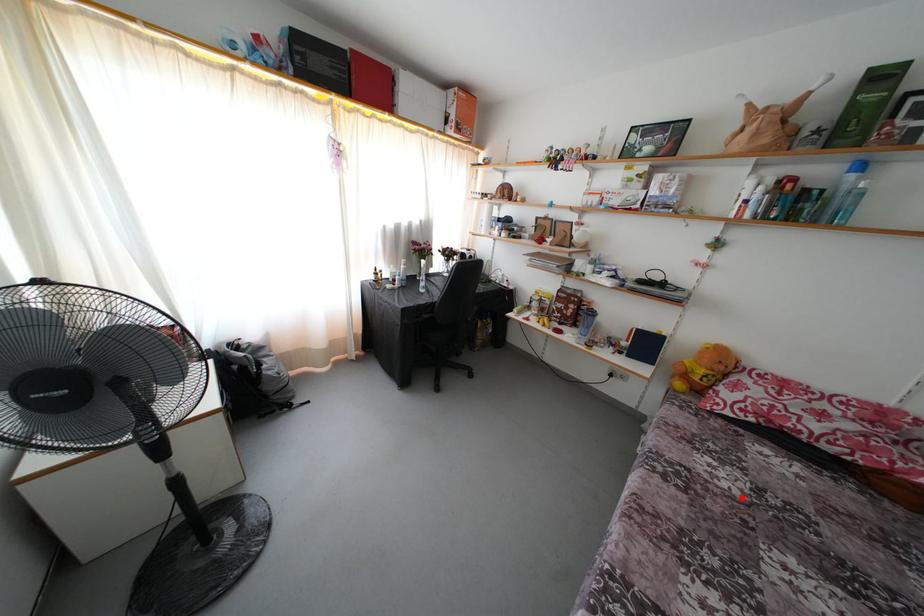
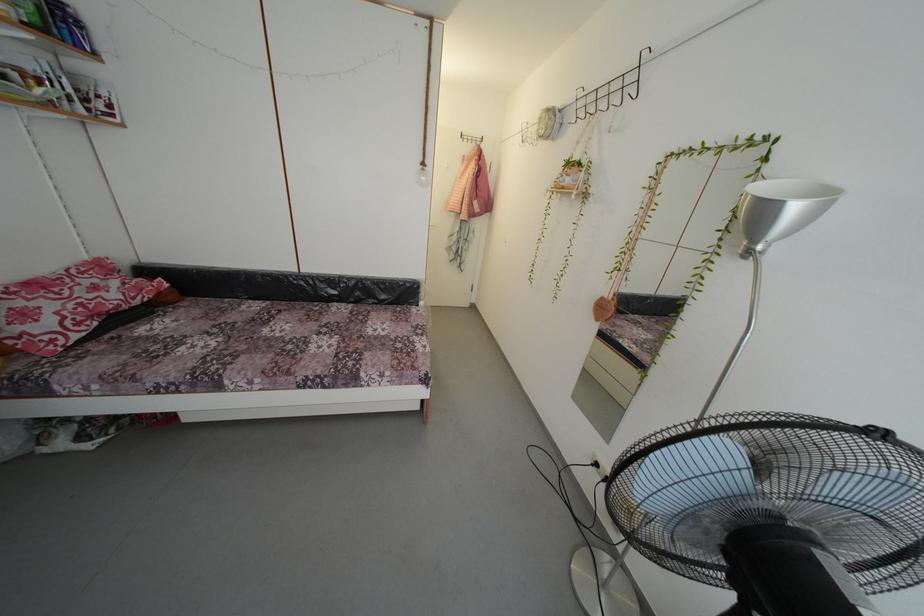
Locate, in the second image, the point that corresponds to the highlighted location in the first image.

(225, 345)